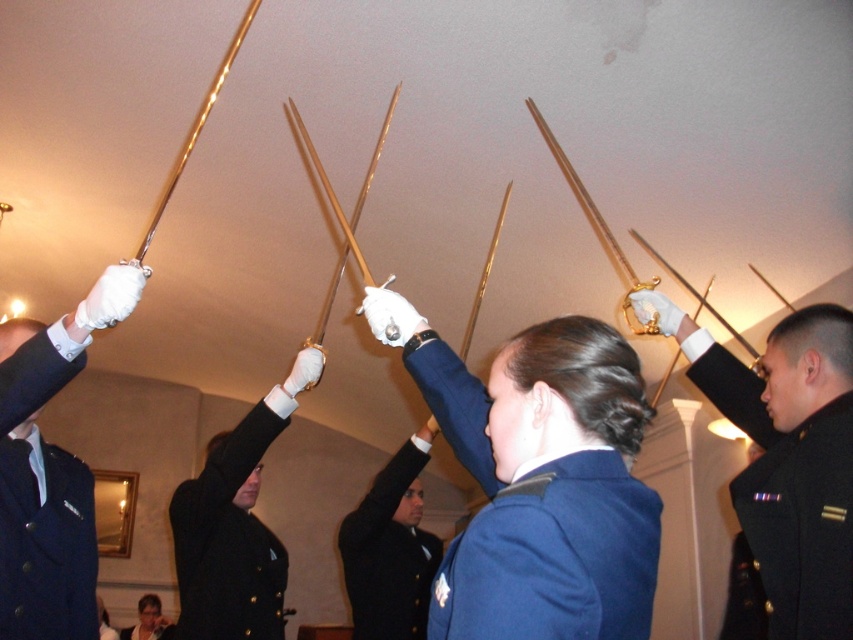
You are an event photographer at the ceremony. You need to capture a photo where both the blue woolen blazer at upper center and the matte black hair at upper center are visible. Based on their positions, which object should you position your camera to the left of to ensure both are in frame?

The blue woolen blazer at upper center is to the right of matte black hair at upper center. To capture both in the frame, position the camera to the left of the blue woolen blazer at upper center so that the matte black hair at upper center is on the left side and the blazer is on the right side within the camera view.

You are a photographer trying to capture the ceremonial sword salute. You notice a point at coordinates (788, 458) in the image. Based on the scene description, what object or part of the scene is most likely located at this point?

The point at (788, 458) is on the shiny black uniform at upper right.